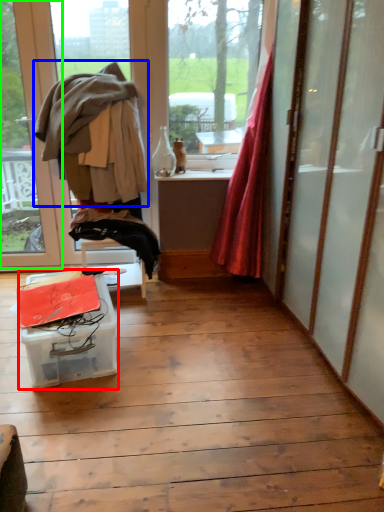
Question: Considering the real-world distances, which object is closest to table (highlighted by a red box)? clothing (highlighted by a blue box) or window (highlighted by a green box).

Choices:
 (A) clothing
 (B) window

Answer: (A)